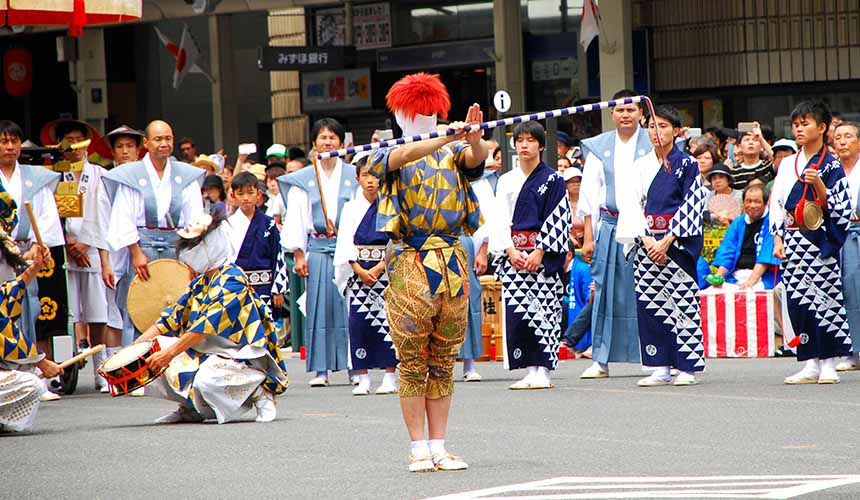
In order to click on fabric flowers in this screenshot , I will do 39,271, 52,316.